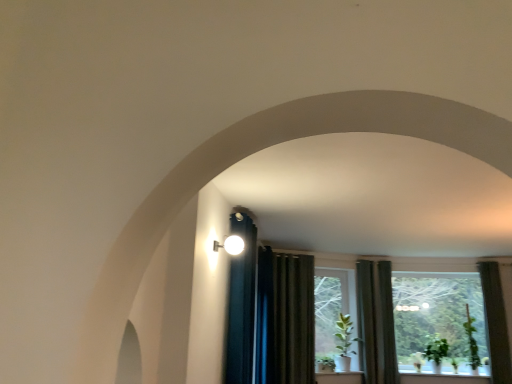
Question: Is green matte plant at center behind green matte plant at center?

Choices:
 (A) yes
 (B) no

Answer: (B)

Question: Considering the relative sizes of green matte plant at center and green matte plant at center in the image provided, is green matte plant at center thinner than green matte plant at center?

Choices:
 (A) yes
 (B) no

Answer: (B)

Question: Is green matte plant at center with green matte plant at center?

Choices:
 (A) yes
 (B) no

Answer: (B)

Question: From a real-world perspective, is green matte plant at center on green matte plant at center?

Choices:
 (A) yes
 (B) no

Answer: (B)

Question: Is green matte plant at center at the back of green matte plant at center?

Choices:
 (A) no
 (B) yes

Answer: (B)

Question: Is dark green fabric curtain at right, arranged as the 1th curtain when viewed from the right, spatially inside green matte plant at center, or outside of it?

Choices:
 (A) inside
 (B) outside

Answer: (B)

Question: From the image's perspective, is dark green fabric curtain at right, positioned as the 3th curtain in left-to-right order, positioned above or below green matte plant at center?

Choices:
 (A) below
 (B) above

Answer: (B)

Question: In terms of width, does dark green fabric curtain at right, positioned as the 3th curtain in left-to-right order, look wider or thinner when compared to green matte plant at center?

Choices:
 (A) wide
 (B) thin

Answer: (B)

Question: Is point (507, 370) closer or farther from the camera than point (338, 354)?

Choices:
 (A) farther
 (B) closer

Answer: (B)

Question: From a real-world perspective, is green leafy plant at right, which is the 1th plant in right-to-left order, above or below green matte plant at center?

Choices:
 (A) above
 (B) below

Answer: (A)

Question: Is green leafy plant at right, the second plant in the left-to-right sequence, to the left or to the right of green matte plant at center in the image?

Choices:
 (A) right
 (B) left

Answer: (A)

Question: Considering the positions of green leafy plant at right, which is the 1th plant in right-to-left order, and green matte plant at center in the image, is green leafy plant at right, which is the 1th plant in right-to-left order, bigger or smaller than green matte plant at center?

Choices:
 (A) big
 (B) small

Answer: (B)

Question: Is green leafy plant at right, the second plant in the left-to-right sequence, situated inside green matte plant at center or outside?

Choices:
 (A) outside
 (B) inside

Answer: (A)

Question: In terms of height, does matte white sconce at upper center look taller or shorter compared to green matte plant at lower right, which appears as the 2th plant when viewed from the right?

Choices:
 (A) short
 (B) tall

Answer: (A)

Question: Is matte white sconce at upper center bigger or smaller than green matte plant at lower right, which is the first plant from left to right?

Choices:
 (A) small
 (B) big

Answer: (A)